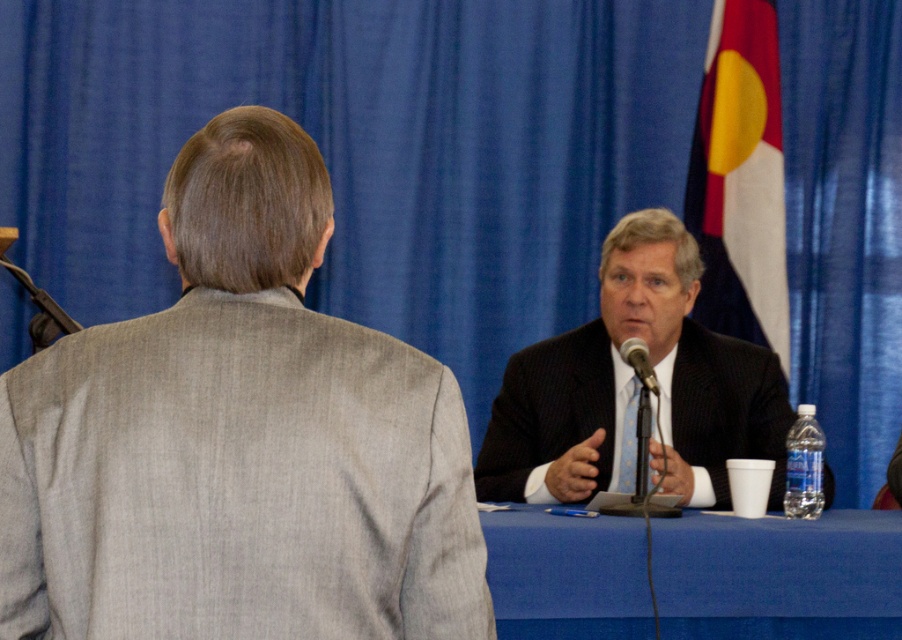
You are a photographer at a press conference. You need to take a photo of the person in the gray textured suit at upper left. Where should you aim your camera to capture them?

You should aim your camera at point (238, 440) to capture the person in the gray textured suit at upper left.

You are a photographer at a press conference. You need to capture a clear photo of the dark suit at center and the metallic silver microphone at center. Based on their positions, which object is closer to the camera?

The dark suit at center is positioned under the metallic silver microphone at center, so the microphone is closer to the camera than the dark suit at center.

You are a stagehand who needs to adjust the microphone stand. The metallic silver microphone at center must be moved closer to the white fabric flag at upper right so that the distance between them is exactly 1.5 meters. Is the current distance sufficient for this adjustment?

The current distance between the white fabric flag at upper right and the metallic silver microphone at center is 1.49 meters, which is just 1 centimeter less than the required 1.5 meters. Therefore, the microphone needs to be moved slightly closer to the flag to achieve the desired distance.